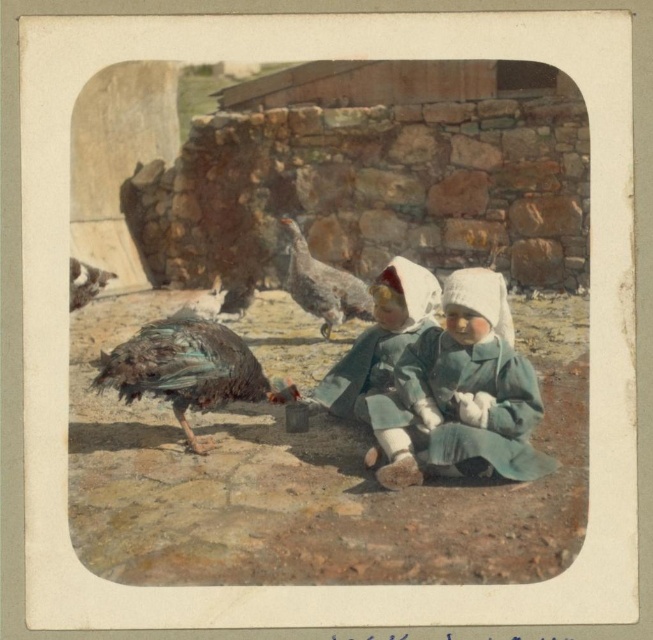
Question: Which point is closer to the camera?

Choices:
 (A) light green fabric doll at center
 (B) brown speckled feather at upper left

Answer: (A)

Question: Is multicolored feathered bird at center behind matte green dress at center?

Choices:
 (A) no
 (B) yes

Answer: (B)

Question: Is multicolored feathered bird at center further to camera compared to gray feathered turkey at center?

Choices:
 (A) no
 (B) yes

Answer: (A)

Question: From the image, what is the correct spatial relationship of matte green dress at center in relation to gray feathered turkey at center?

Choices:
 (A) below
 (B) above

Answer: (A)

Question: Which point is farther to the camera?

Choices:
 (A) click(375, 374)
 (B) click(422, 477)
 (C) click(326, 296)
 (D) click(223, 403)

Answer: (C)

Question: Which object is the farthest from the gray feathered turkey at center?

Choices:
 (A) light green fabric doll at center
 (B) multicolored feathered bird at center

Answer: (A)